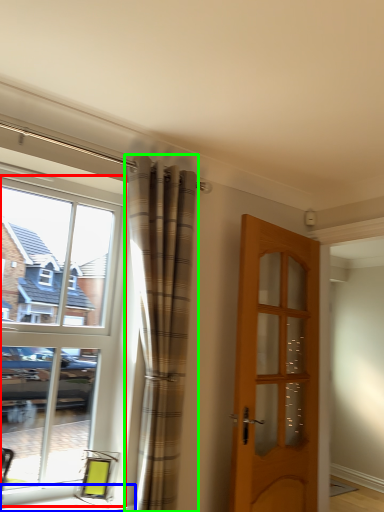
Question: Which is farther away from window (highlighted by a red box)? window sill (highlighted by a blue box) or curtain (highlighted by a green box)?

Choices:
 (A) window sill
 (B) curtain

Answer: (A)